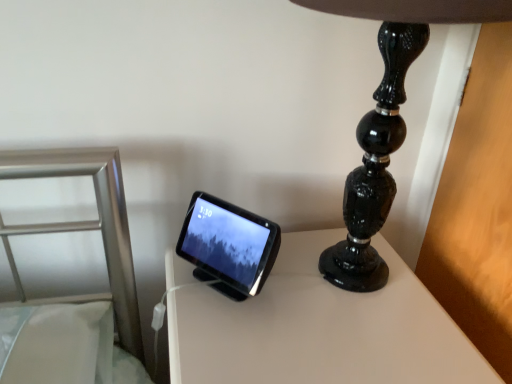
The height and width of the screenshot is (384, 512). I want to click on white glossy table at center, so pyautogui.click(x=320, y=328).

At what (x,y) coordinates should I click in order to perform the action: click on matte black tablet at center. Please return your answer as a coordinate pair (x, y). The height and width of the screenshot is (384, 512). Looking at the image, I should click on (229, 244).

Locate an element on the screen. Image resolution: width=512 pixels, height=384 pixels. white glossy table at center is located at coordinates (320, 328).

Is black glossy lamp at upper right next to white glossy table at center and touching it?

There is a gap between black glossy lamp at upper right and white glossy table at center.

Considering the positions of point (371, 191) and point (196, 324), is point (371, 191) closer or farther from the camera than point (196, 324)?

Point (371, 191).

Between black glossy lamp at upper right and white glossy table at center, which one has larger width?

white glossy table at center.

Who is taller, matte black tablet at center or black glossy lamp at upper right?

black glossy lamp at upper right is taller.

Which object is positioned more to the right, matte black tablet at center or black glossy lamp at upper right?

black glossy lamp at upper right.

Does matte black tablet at center have a lesser width compared to black glossy lamp at upper right?

Correct, the width of matte black tablet at center is less than that of black glossy lamp at upper right.

From a real-world perspective, does matte black tablet at center stand above black glossy lamp at upper right?

Actually, matte black tablet at center is physically below black glossy lamp at upper right in the real world.

Considering the sizes of objects white glossy table at center and black glossy lamp at upper right in the image provided, who is smaller, white glossy table at center or black glossy lamp at upper right?

black glossy lamp at upper right is smaller.

Where is `table on the left of black glossy lamp at upper right`? The height and width of the screenshot is (384, 512). table on the left of black glossy lamp at upper right is located at coordinates (320, 328).

From the image's perspective, is white glossy table at center under black glossy lamp at upper right?

Yes.

Is point (361, 314) closer or farther from the camera than point (359, 204)?

Point (361, 314) is closer to the camera than point (359, 204).

Considering the relative sizes of black glossy lamp at upper right and matte black tablet at center in the image provided, is black glossy lamp at upper right shorter than matte black tablet at center?

No, black glossy lamp at upper right is not shorter than matte black tablet at center.

Can you confirm if black glossy lamp at upper right is positioned to the right of matte black tablet at center?

Indeed, black glossy lamp at upper right is positioned on the right side of matte black tablet at center.

Image resolution: width=512 pixels, height=384 pixels. What are the coordinates of `lamp above the matte black tablet at center (from the image's perspective)` in the screenshot? It's located at (386, 123).

Is black glossy lamp at upper right further to the viewer compared to matte black tablet at center?

That is False.

Which point is more forward, (310, 342) or (200, 254)?

The point (310, 342) is more forward.

Which object is thinner, white glossy table at center or matte black tablet at center?

matte black tablet at center.

Who is smaller, white glossy table at center or matte black tablet at center?

With smaller size is matte black tablet at center.

How many degrees apart are the facing directions of white glossy table at center and matte black tablet at center?

The facing directions of white glossy table at center and matte black tablet at center are 52.7 degrees apart.

Which point is more forward, (209, 235) or (384, 259)?

The point (209, 235) is closer to the camera.

Considering the positions of objects matte black tablet at center and white glossy table at center in the image provided, who is more to the right, matte black tablet at center or white glossy table at center?

white glossy table at center is more to the right.

From a real-world perspective, who is located lower, matte black tablet at center or white glossy table at center?

In real-world perspective, white glossy table at center is lower.

Is matte black tablet at center smaller than white glossy table at center?

Yes.

Locate an element on the screen. lamp that appears above the white glossy table at center (from a real-world perspective) is located at coordinates (386, 123).

Identify the location of lamp located in front of the matte black tablet at center. (386, 123).

Which object lies further to the anchor point white glossy table at center, black glossy lamp at upper right or matte black tablet at center?

black glossy lamp at upper right.

Which object lies nearer to the anchor point matte black tablet at center, black glossy lamp at upper right or white glossy table at center?

Based on the image, white glossy table at center appears to be nearer to matte black tablet at center.

From the picture: Looking at the image, which one is located closer to black glossy lamp at upper right, matte black tablet at center or white glossy table at center?

The object closer to black glossy lamp at upper right is white glossy table at center.

Based on their spatial positions, is white glossy table at center or matte black tablet at center further from black glossy lamp at upper right?

Among the two, matte black tablet at center is located further to black glossy lamp at upper right.

When comparing their distances from white glossy table at center, does matte black tablet at center or black glossy lamp at upper right seem closer?

matte black tablet at center is closer to white glossy table at center.

Which object lies further to the anchor point matte black tablet at center, white glossy table at center or black glossy lamp at upper right?

black glossy lamp at upper right is positioned further to the anchor matte black tablet at center.

In order to click on tablet computer that lies between black glossy lamp at upper right and white glossy table at center from top to bottom in this screenshot , I will do `click(229, 244)`.